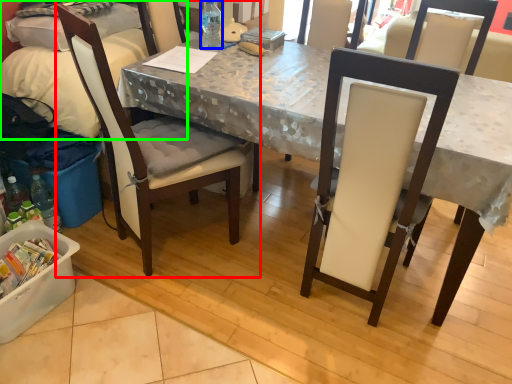
Question: Estimate the real-world distances between objects in this image. Which object is closer to chair (highlighted by a red box), bottle (highlighted by a blue box) or leftover (highlighted by a green box)?

Choices:
 (A) bottle
 (B) leftover

Answer: (B)